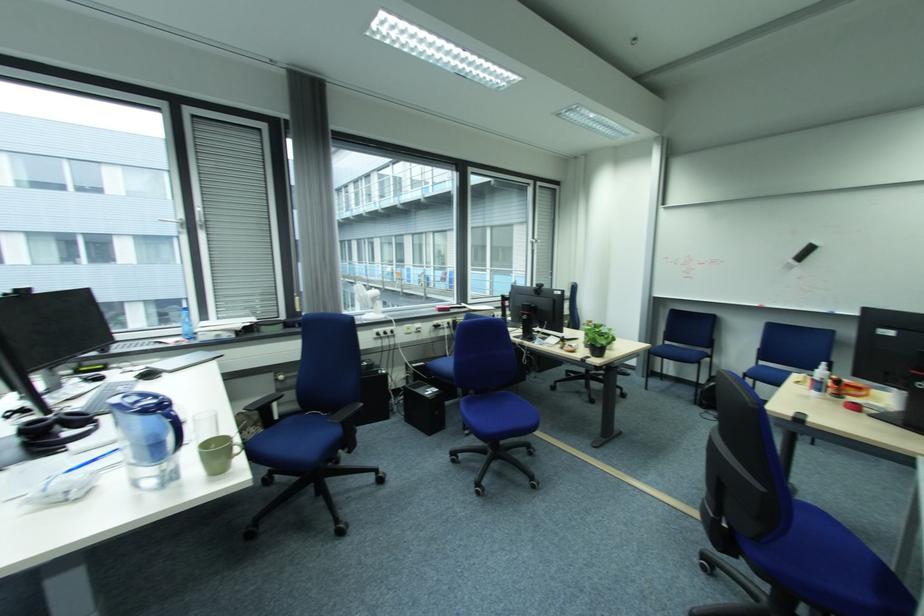
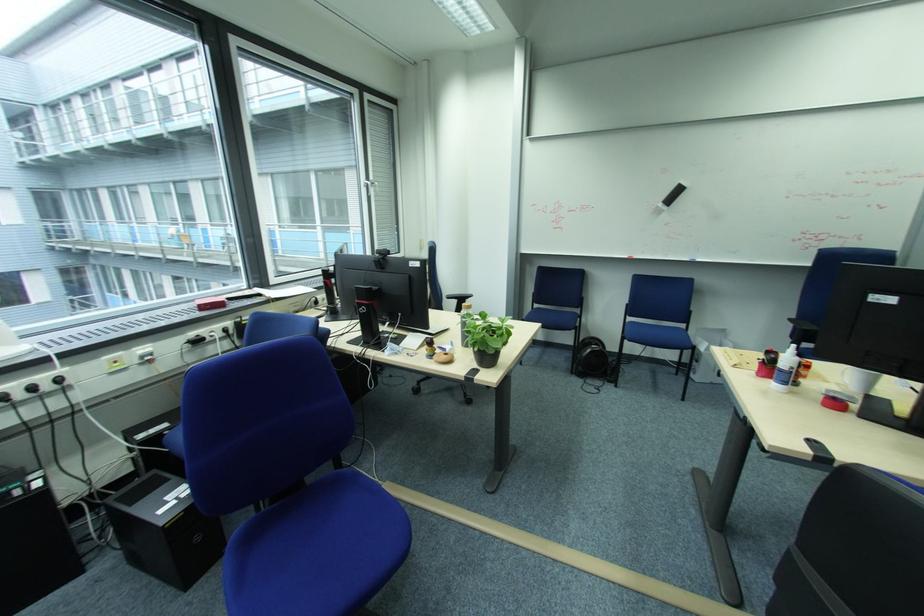
Where in the second image is the point corresponding to pixel 821 392 from the first image?

(784, 387)